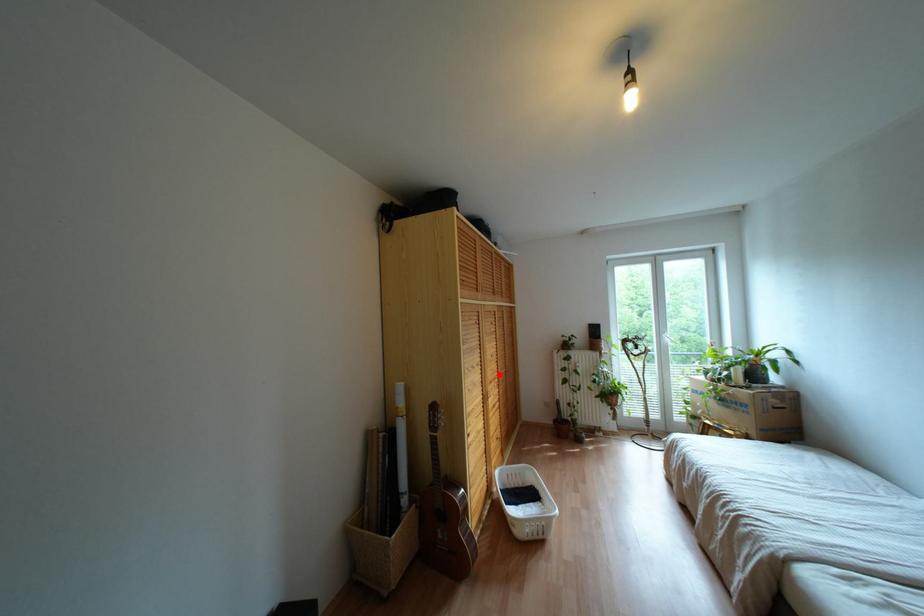
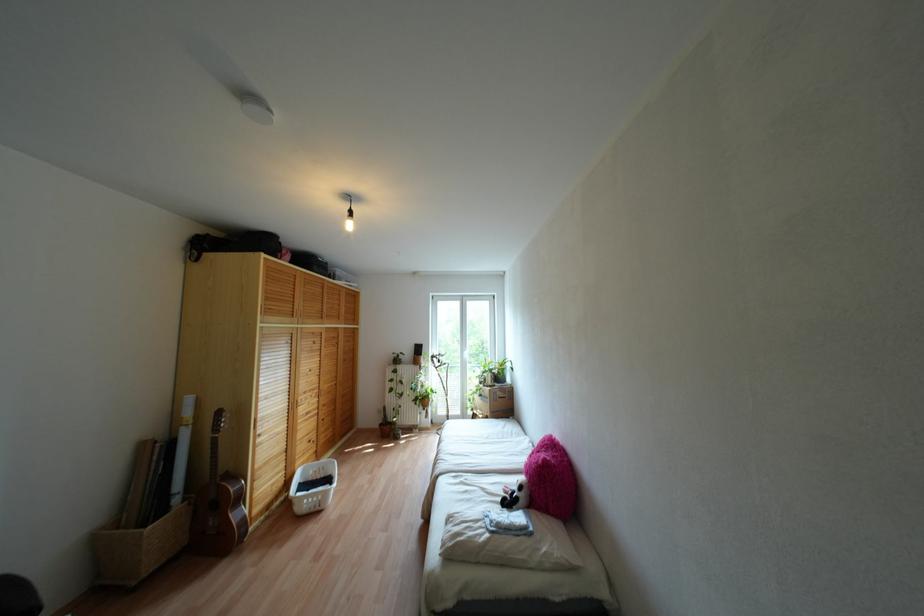
The point at the highlighted location is marked in the first image. Where is the corresponding point in the second image?

(324, 387)